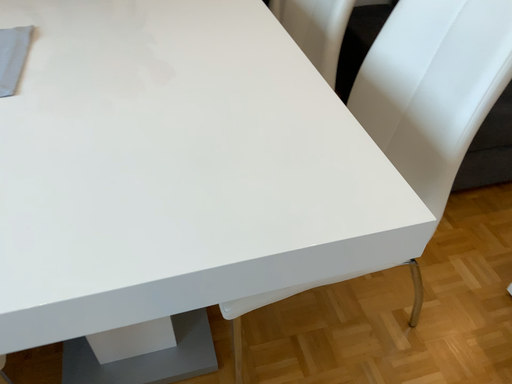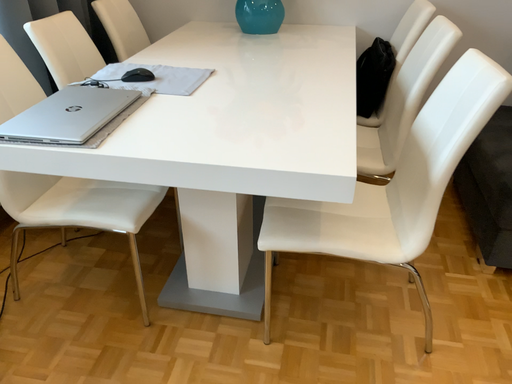
Question: How did the camera likely rotate when shooting the video?

Choices:
 (A) rotated left
 (B) rotated right

Answer: (A)